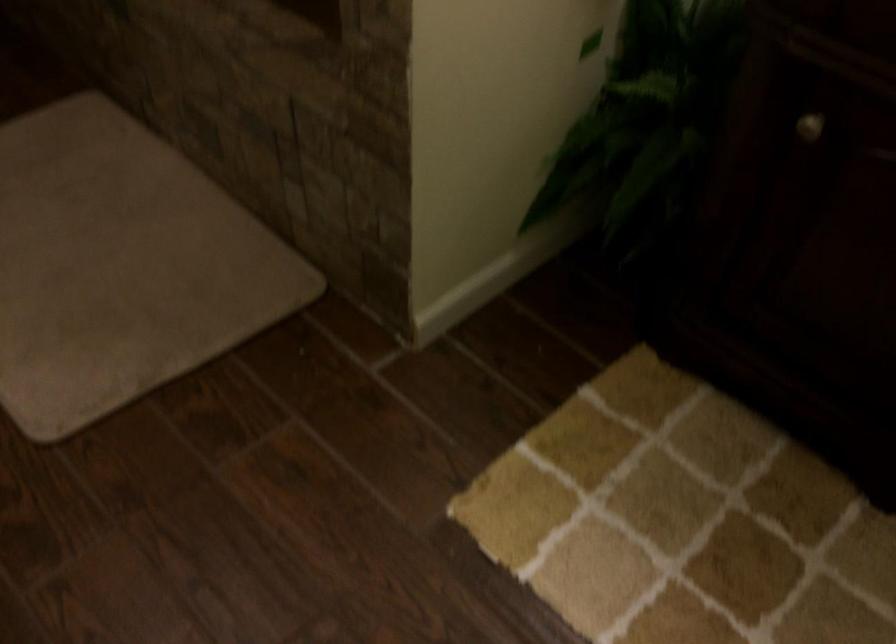
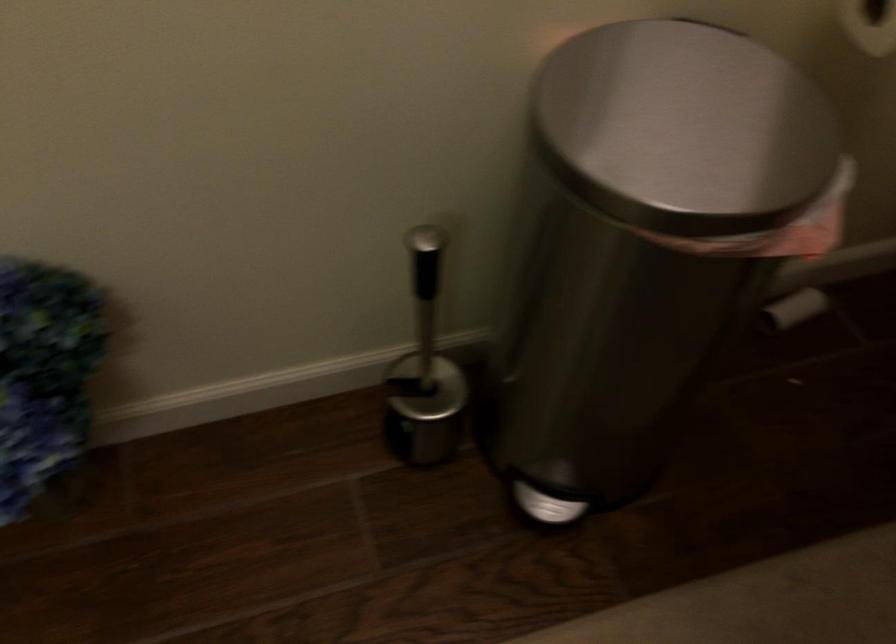
Based on the continuous images, in which direction is the camera rotating?

The camera rotated toward left-down.